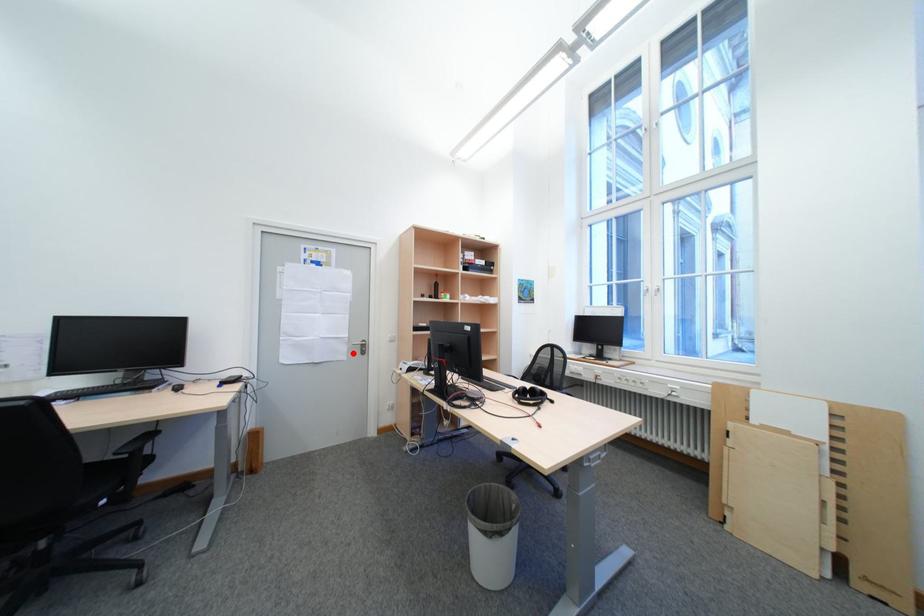
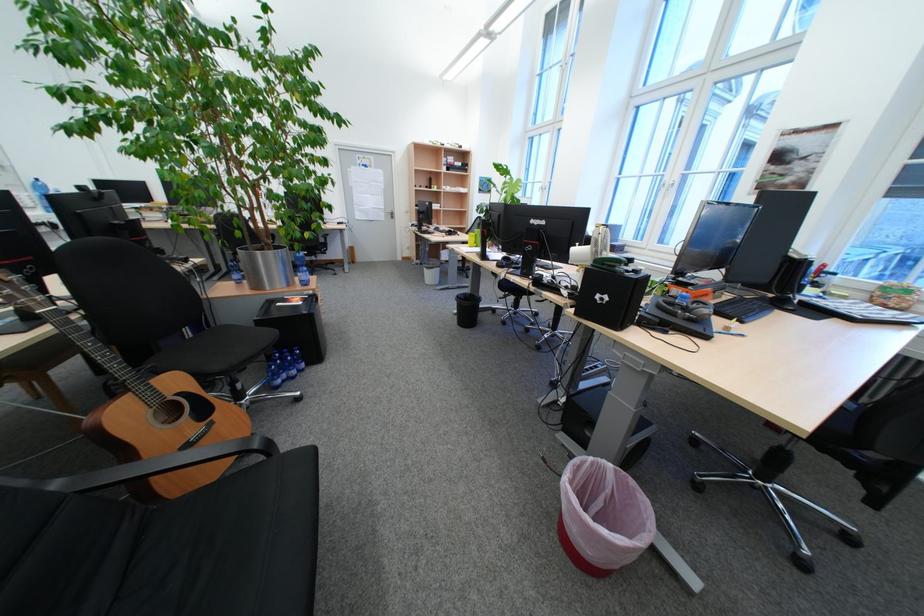
Question: I am providing you with two images of the same scene from different viewpoints. A red point is marked on the first image. Can you still see the location of the red point in image 2?

Choices:
 (A) Yes
 (B) No

Answer: (A)